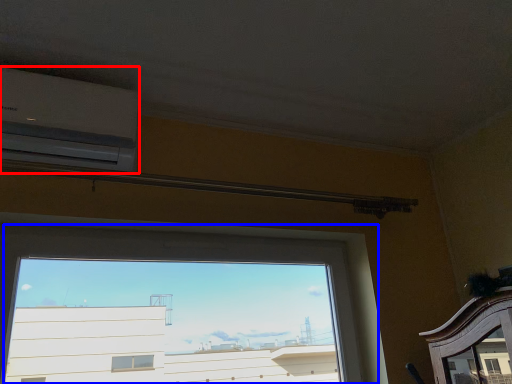
Question: Which point is further to the camera, air conditioning (highlighted by a red box) or window (highlighted by a blue box)?

Choices:
 (A) air conditioning
 (B) window

Answer: (A)